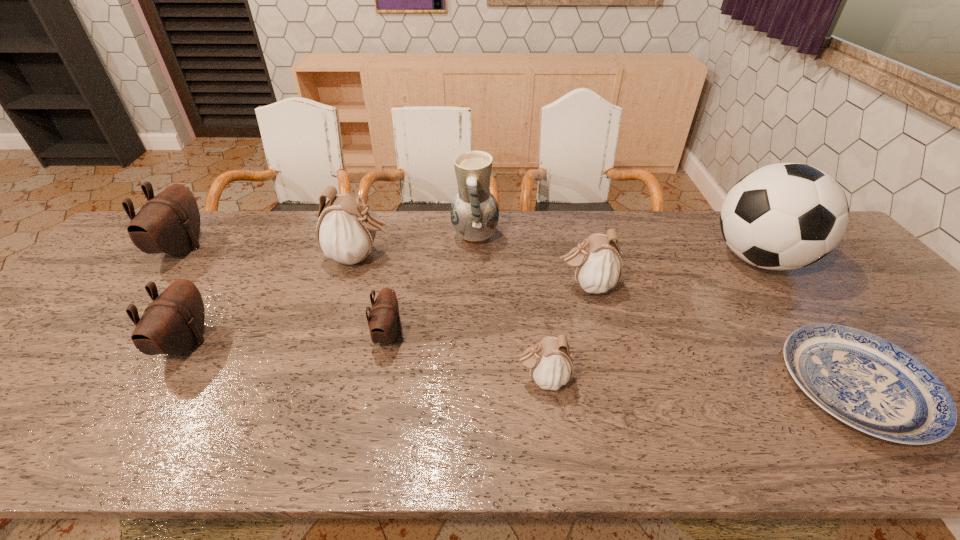
At what (x,y) coordinates should I click in order to perform the action: click on black soccer ball. Please return your answer as a coordinate pair (x, y). Looking at the image, I should click on (784, 216).

Where is `pottery`? This screenshot has height=540, width=960. pottery is located at coordinates (474, 213).

You are a GUI agent. You are given a task and a screenshot of the screen. Output one action in this format:
    pyautogui.click(x=<x>, y=<y>)
    Task: Click on the leftmost white pouch
    
    Given the screenshot: What is the action you would take?
    pyautogui.click(x=346, y=230)

The width and height of the screenshot is (960, 540). Identify the location of the leftmost object. (169, 223).

I want to click on the farthest brown pouch, so click(169, 223).

Where is `the rightmost pouch`? The image size is (960, 540). the rightmost pouch is located at coordinates (597, 265).

You are a GUI agent. You are given a task and a screenshot of the screen. Output one action in this format:
    pyautogui.click(x=<x>, y=<y>)
    Task: Click on the seventh object from left to right
    The image size is (960, 540).
    Given the screenshot: What is the action you would take?
    pyautogui.click(x=597, y=265)

At what (x,y) coordinates should I click in order to perform the action: click on the second brown pouch from right to left. Please return your answer as a coordinate pair (x, y). The width and height of the screenshot is (960, 540). Looking at the image, I should click on (172, 324).

I want to click on the second object from left to right, so click(172, 324).

Identify the location of the fifth pouch from left to right. The width and height of the screenshot is (960, 540). (550, 361).